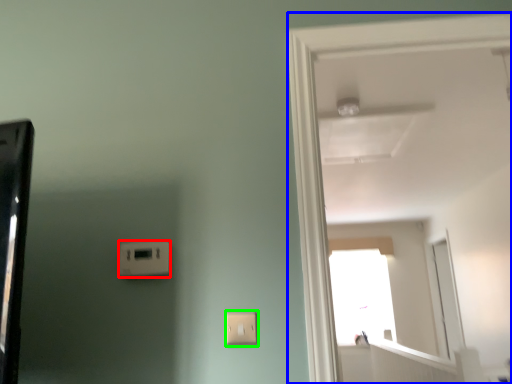
Question: Estimate the real-world distances between objects in this image. Which object is closer to light switch (highlighted by a red box), door (highlighted by a blue box) or light switch (highlighted by a green box)?

Choices:
 (A) door
 (B) light switch

Answer: (B)